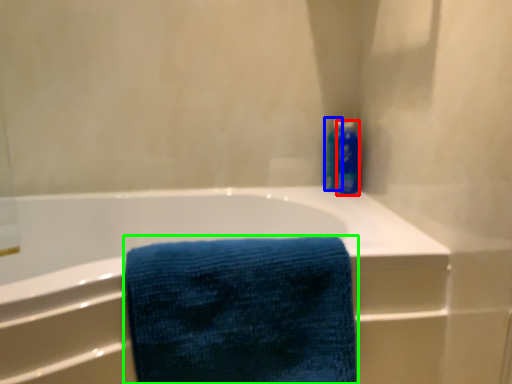
Question: Estimate the real-world distances between objects in this image. Which object is closer to cleaning product (highlighted by a red box), toiletry (highlighted by a blue box) or towel (highlighted by a green box)?

Choices:
 (A) toiletry
 (B) towel

Answer: (A)